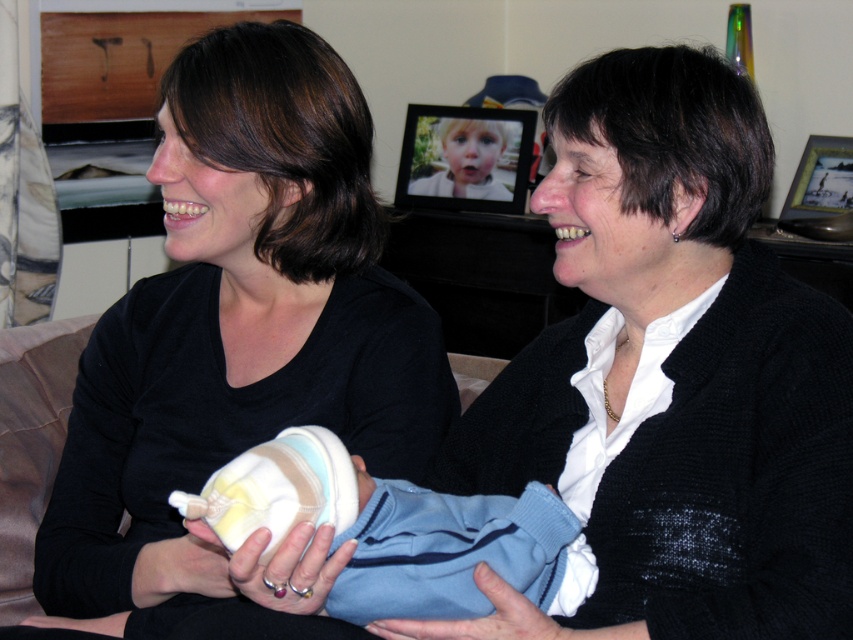
You are standing in the room and want to place a small gift between the two points, point [593,628] and point [195,592]. Which point should the gift be closer to in order to be in front of the other point?

The gift should be closer to point [593,628] because it is in front of point [195,592].

In the scene shown: You are a photographer setting up a shoot in the scene described. You need to place a spotlight on the matte black sweater at center and another on the matte black shirt at center. Since both are at center, which spotlight should you place to the right to ensure it aligns with their positions?

The matte black sweater at center is positioned on the right side of matte black shirt at center, so the spotlight for the matte black sweater at center should be placed to the right of the spotlight for the matte black shirt at center.